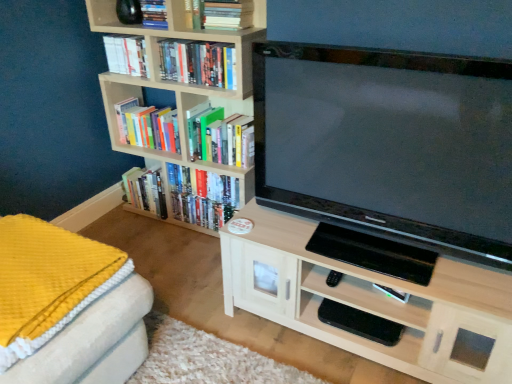
Question: Considering the relative sizes of hardcover book at center, which is the sixth book in top-to-bottom order, and hardcover books at upper center, the 4th book positioned from the top, in the image provided, is hardcover book at center, which is the sixth book in top-to-bottom order, thinner than hardcover books at upper center, the 4th book positioned from the top,?

Choices:
 (A) no
 (B) yes

Answer: (A)

Question: Is hardcover book at center, which is the sixth book in top-to-bottom order, far from hardcover books at upper center, the 4th book positioned from the top?

Choices:
 (A) no
 (B) yes

Answer: (A)

Question: Is hardcover book at center, placed as the 1th book when sorted from bottom to top, oriented towards hardcover books at upper center, the 4th book positioned from the top?

Choices:
 (A) no
 (B) yes

Answer: (A)

Question: Does hardcover book at center, placed as the 1th book when sorted from bottom to top, have a lesser height compared to hardcover books at upper center, the 4th book positioned from the top?

Choices:
 (A) yes
 (B) no

Answer: (B)

Question: Considering the relative positions of hardcover book at center, which is the sixth book in top-to-bottom order, and hardcover books at upper center, which appears as the 3th book when ordered from the bottom, in the image provided, is hardcover book at center, which is the sixth book in top-to-bottom order, to the right of hardcover books at upper center, which appears as the 3th book when ordered from the bottom, from the viewer's perspective?

Choices:
 (A) no
 (B) yes

Answer: (B)

Question: Is hardcover book at upper left, marked as the third book in a top-to-bottom arrangement, wider or thinner than matte black mouse at upper left, acting as the 2th shelf starting from the bottom?

Choices:
 (A) thin
 (B) wide

Answer: (A)

Question: From a real-world perspective, is hardcover book at upper left, which is the 4th book in bottom-to-top order, above or below matte black mouse at upper left, which appears as the 1th shelf when viewed from the left?

Choices:
 (A) below
 (B) above

Answer: (A)

Question: In the image, is hardcover book at upper left, marked as the third book in a top-to-bottom arrangement, positioned in front of or behind matte black mouse at upper left, the 2th shelf when ordered from right to left?

Choices:
 (A) behind
 (B) front

Answer: (A)

Question: Is hardcover book at upper left, marked as the third book in a top-to-bottom arrangement, bigger or smaller than matte black mouse at upper left, acting as the 2th shelf starting from the bottom?

Choices:
 (A) big
 (B) small

Answer: (A)

Question: From a real-world perspective, relative to wooden bookshelf at left, is hardcover book at center, which is the sixth book in top-to-bottom order, vertically above or below?

Choices:
 (A) above
 (B) below

Answer: (B)

Question: Considering the relative positions of hardcover book at center, which is the sixth book in top-to-bottom order, and wooden bookshelf at left in the image provided, is hardcover book at center, which is the sixth book in top-to-bottom order, to the left or to the right of wooden bookshelf at left?

Choices:
 (A) left
 (B) right

Answer: (B)

Question: From their relative heights in the image, would you say hardcover book at center, which is the sixth book in top-to-bottom order, is taller or shorter than wooden bookshelf at left?

Choices:
 (A) tall
 (B) short

Answer: (B)

Question: Based on their sizes in the image, would you say hardcover book at center, which is the sixth book in top-to-bottom order, is bigger or smaller than wooden bookshelf at left?

Choices:
 (A) small
 (B) big

Answer: (A)

Question: Based on their sizes in the image, would you say hardcover book at upper center, placed as the second book when sorted from top to bottom, is bigger or smaller than light wood cabinet at center, the 2th shelf positioned from the top?

Choices:
 (A) small
 (B) big

Answer: (A)

Question: Considering the positions of point (194, 11) and point (453, 350), is point (194, 11) closer or farther from the camera than point (453, 350)?

Choices:
 (A) closer
 (B) farther

Answer: (B)